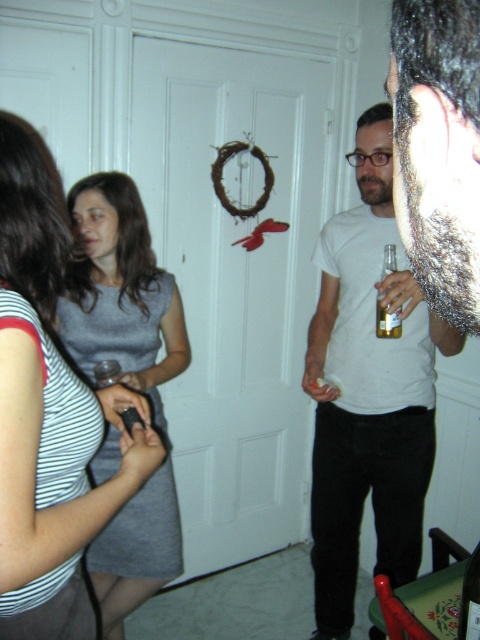
You are organizing a small party and need to place a decorative item on a table that can only accommodate items narrower than the gray matte dress at center. Can the clear glass bottle at center fit on the table?

The gray matte dress at center is wider than the clear glass bottle at center. Since the table can only accommodate items narrower than the gray matte dress at center, the clear glass bottle at center can fit on the table because it is narrower.

You are standing in the room and want to reach both the point at coordinates (127, 241) and the point at (385, 323). Which point should you reach first if you want to touch them in order from closest to farthest?

You should reach the point at coordinates (127, 241) first because it is closer to you than the point at (385, 323).